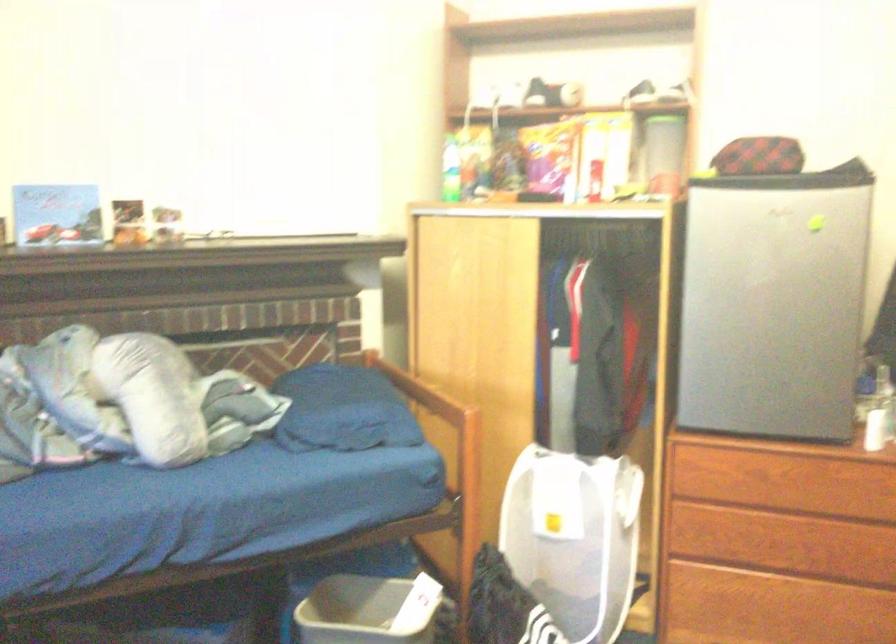
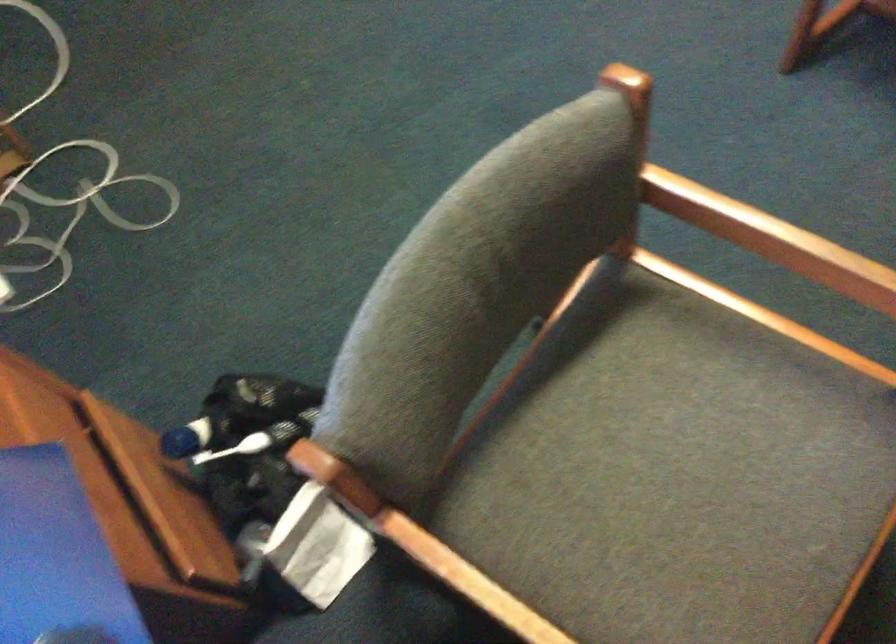
Question: The first image is from the beginning of the video and the second image is from the end. How did the camera likely rotate when shooting the video?

Choices:
 (A) Left
 (B) Right
 (C) Up
 (D) Down

Answer: (D)